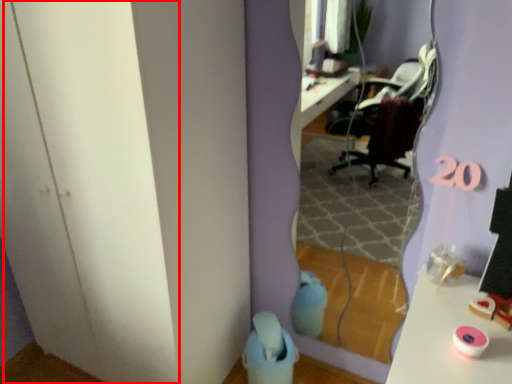
Question: Where is glass door (annotated by the red box) located in relation to mirror in the image?

Choices:
 (A) left
 (B) right

Answer: (A)